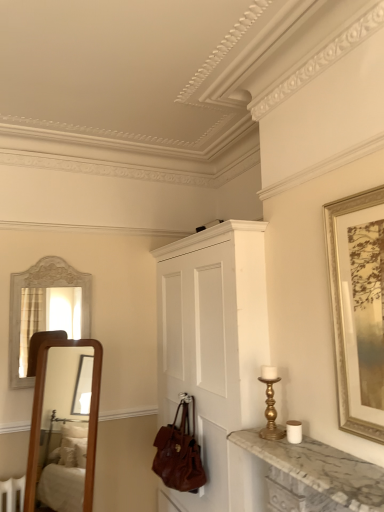
Question: Is white painted wood cabinet at center not within brown leather handbag at lower center?

Choices:
 (A) yes
 (B) no

Answer: (A)

Question: Is white painted wood cabinet at center positioned behind brown leather handbag at lower center?

Choices:
 (A) no
 (B) yes

Answer: (A)

Question: Can you confirm if white painted wood cabinet at center is bigger than brown leather handbag at lower center?

Choices:
 (A) yes
 (B) no

Answer: (A)

Question: From a real-world perspective, does white painted wood cabinet at center stand above brown leather handbag at lower center?

Choices:
 (A) yes
 (B) no

Answer: (A)

Question: Is white painted wood cabinet at center smaller than brown leather handbag at lower center?

Choices:
 (A) yes
 (B) no

Answer: (B)

Question: From a real-world perspective, is brown leather handbag at lower center above or below gold-framed artwork at right?

Choices:
 (A) below
 (B) above

Answer: (A)

Question: Does point (163, 430) appear closer or farther from the camera than point (377, 271)?

Choices:
 (A) farther
 (B) closer

Answer: (A)

Question: Considering their positions, is brown leather handbag at lower center located in front of or behind gold-framed artwork at right?

Choices:
 (A) front
 (B) behind

Answer: (B)

Question: From the image's perspective, is brown leather handbag at lower center located above or below gold-framed artwork at right?

Choices:
 (A) above
 (B) below

Answer: (B)

Question: In terms of height, does gold-framed artwork at right look taller or shorter compared to marble at right?

Choices:
 (A) short
 (B) tall

Answer: (B)

Question: From a real-world perspective, is gold-framed artwork at right positioned above or below marble at right?

Choices:
 (A) above
 (B) below

Answer: (A)

Question: In terms of width, does gold-framed artwork at right look wider or thinner when compared to marble at right?

Choices:
 (A) wide
 (B) thin

Answer: (B)

Question: From the image's perspective, is gold-framed artwork at right above or below marble at right?

Choices:
 (A) above
 (B) below

Answer: (A)

Question: Would you say marble at right is to the left or to the right of brown leather handbag at lower center in the picture?

Choices:
 (A) left
 (B) right

Answer: (B)

Question: Is point (340, 493) positioned closer to the camera than point (165, 435)?

Choices:
 (A) closer
 (B) farther

Answer: (A)